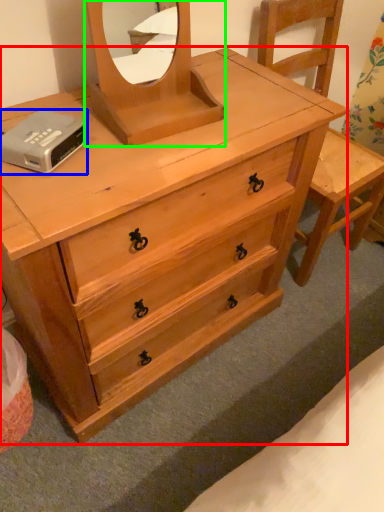
Question: Which is farther away from chest of drawers (highlighted by a red box)? hardware (highlighted by a blue box) or mirror (highlighted by a green box)?

Choices:
 (A) hardware
 (B) mirror

Answer: (A)